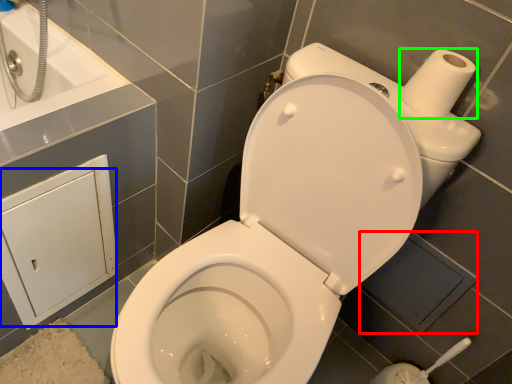
Question: Which object is positioned farthest from square (highlighted by a red box)? Select from screen door (highlighted by a blue box) and toilet paper (highlighted by a green box).

Choices:
 (A) screen door
 (B) toilet paper

Answer: (A)